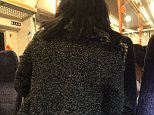
Where is `lights`? lights is located at coordinates (127, 19), (146, 34), (144, 14), (152, 7).